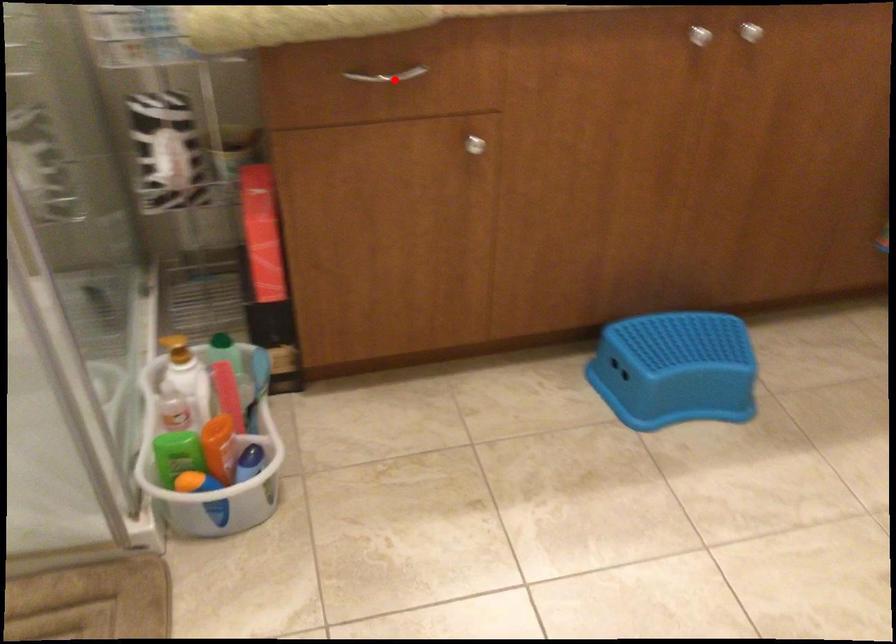
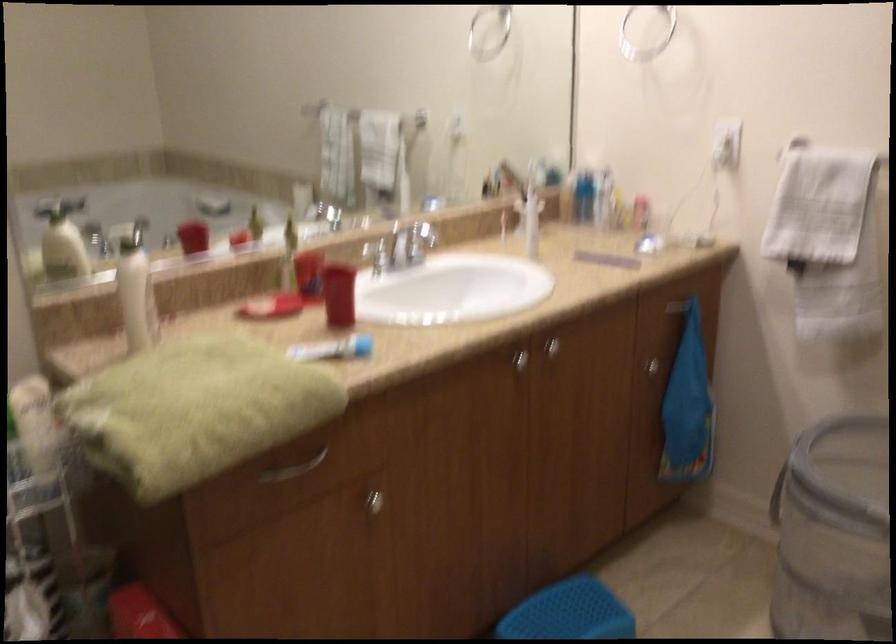
The point at the highlighted location is marked in the first image. Where is the corresponding point in the second image?

(294, 468)